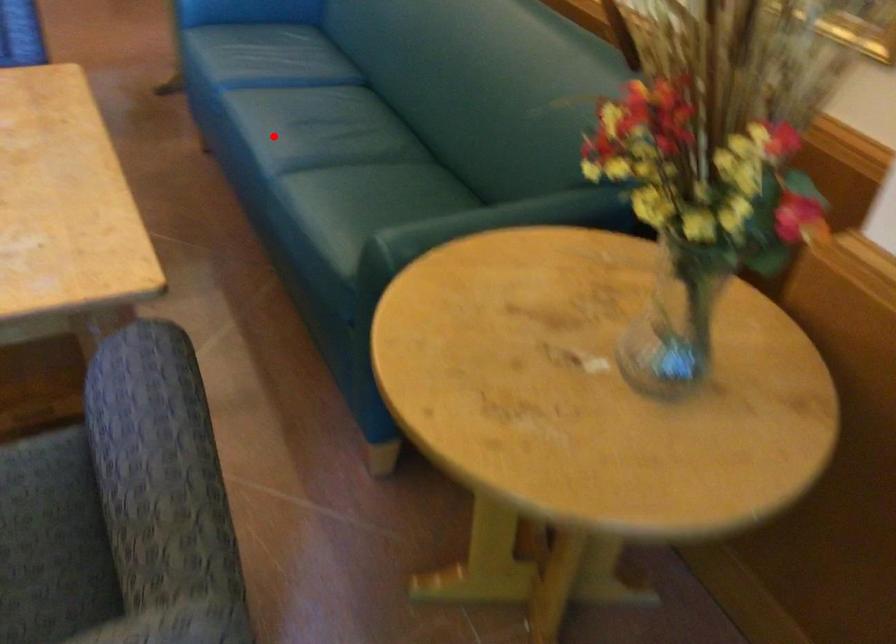
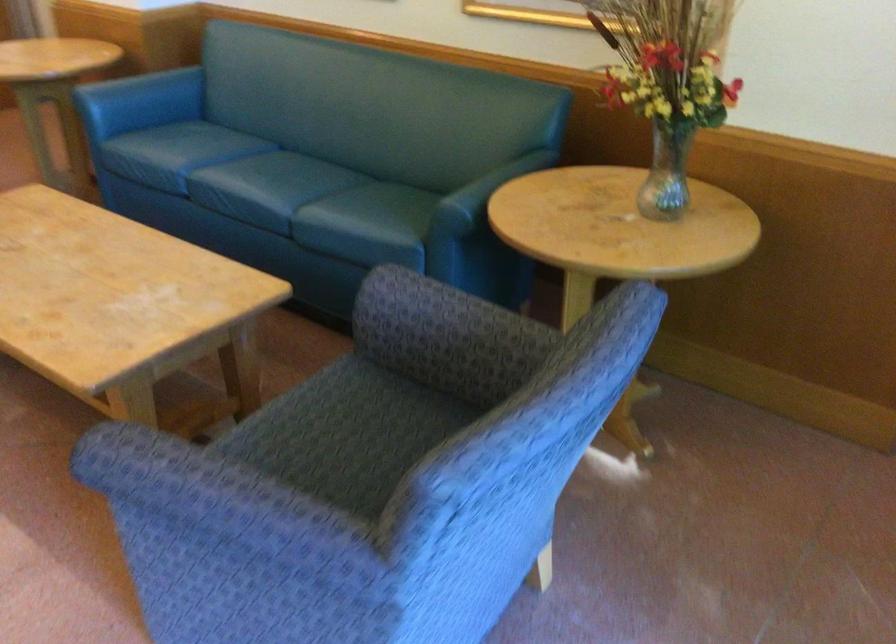
Find the pixel in the second image that matches the highlighted location in the first image.

(269, 187)